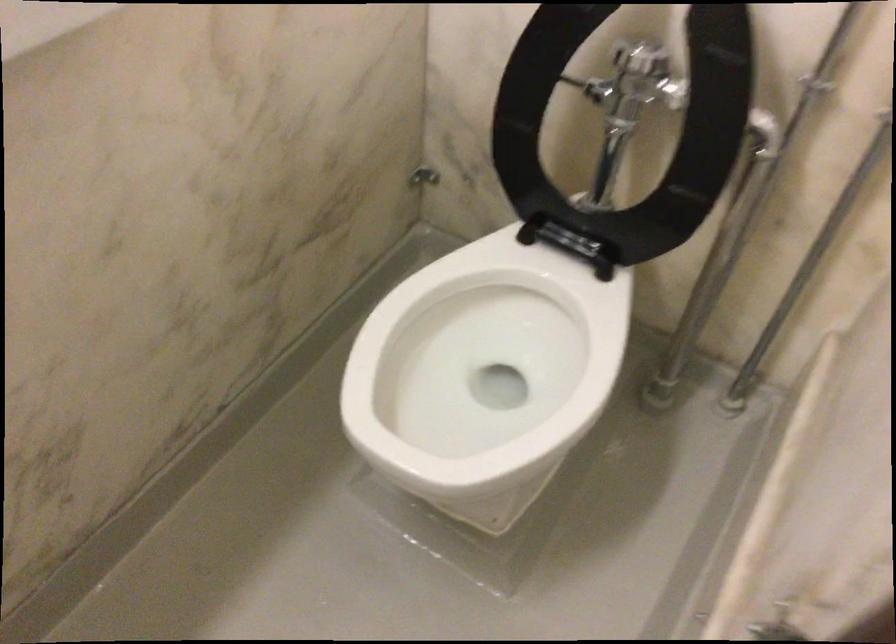
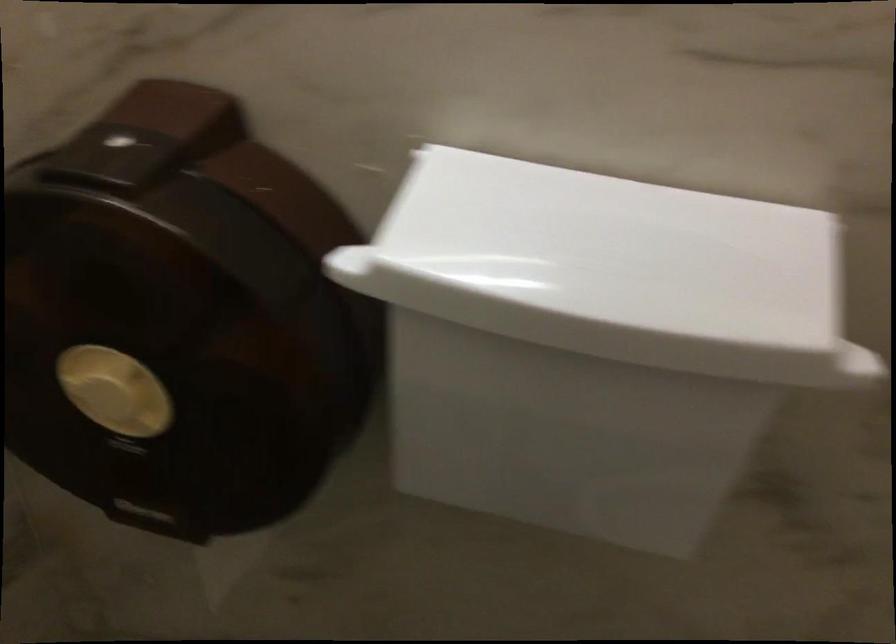
Question: The camera is either moving clockwise (left) or counter-clockwise (right) around the object. The first image is from the beginning of the video and the second image is from the end. Is the camera moving left or right when shooting the video?

Choices:
 (A) Left
 (B) Right

Answer: (B)